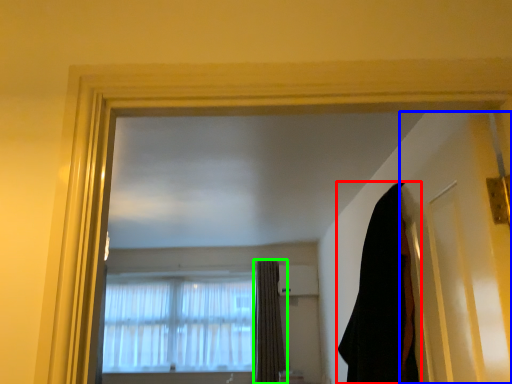
Question: Which object is positioned farthest from curtain (highlighted by a red box)? Select from door (highlighted by a blue box) and curtain (highlighted by a green box).

Choices:
 (A) door
 (B) curtain

Answer: (B)